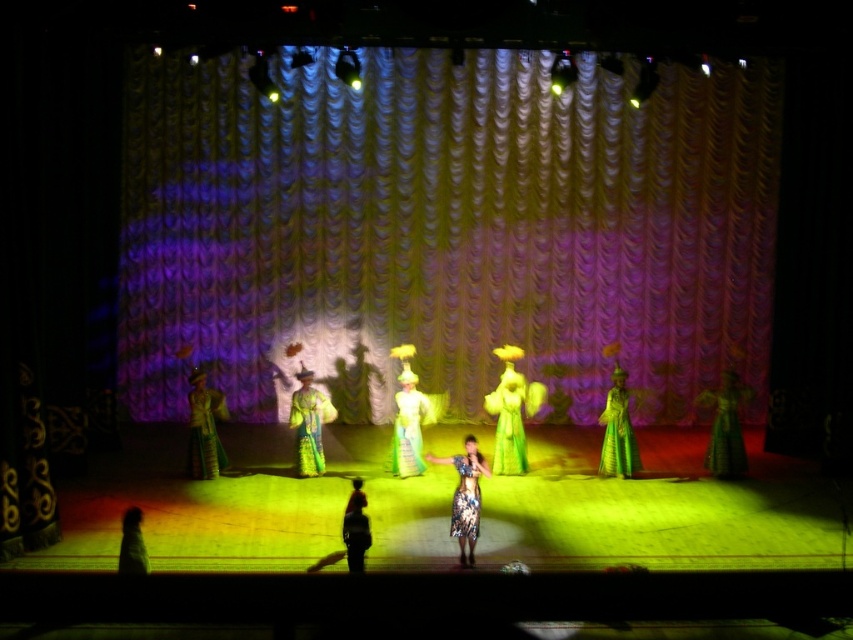
Question: Is green satin dress at center thinner than green silk dress at center?

Choices:
 (A) yes
 (B) no

Answer: (B)

Question: Based on their relative distances, which object is farther from the floral fabric dress at center?

Choices:
 (A) silky green dress at center
 (B) silk green dress at center
 (C) silk robe at left
 (D) matte gold curtain at center

Answer: (D)

Question: Does green silk robe at right come behind silky green dress at center?

Choices:
 (A) yes
 (B) no

Answer: (A)

Question: Among these points, which one is farthest from the camera?

Choices:
 (A) (x=525, y=467)
 (B) (x=474, y=522)
 (C) (x=618, y=365)

Answer: (C)

Question: Among these points, which one is nearest to the camera?

Choices:
 (A) (613, 445)
 (B) (177, 220)
 (C) (508, 460)

Answer: (A)

Question: Can you confirm if silk green dress at center is positioned above silky green dress at center?

Choices:
 (A) yes
 (B) no

Answer: (A)